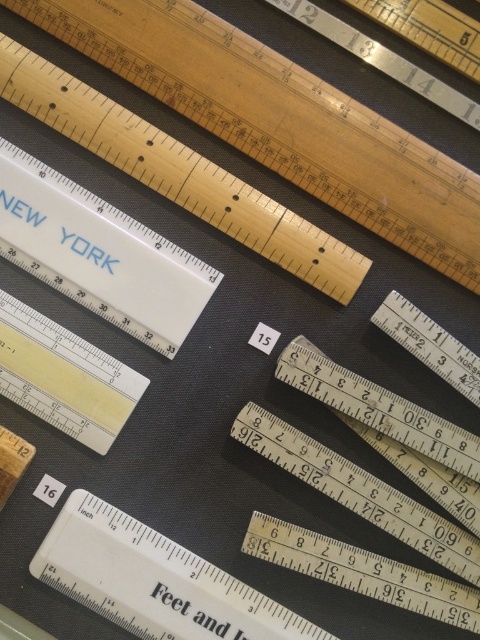
Question: Which of the following is the closest to the observer?

Choices:
 (A) (224, 637)
 (B) (176, 157)

Answer: (A)

Question: Which object appears farthest from the camera in this image?

Choices:
 (A) wooden ruler at center
 (B) wooden ruler at upper center

Answer: (B)

Question: Is wooden ruler at upper center further to the viewer compared to wooden ruler at center?

Choices:
 (A) no
 (B) yes

Answer: (B)

Question: Is white plastic ruler at lower center bigger than yellow matte ruler at center?

Choices:
 (A) no
 (B) yes

Answer: (B)

Question: Which of the following is the farthest from the observer?

Choices:
 (A) (425, 573)
 (B) (325, 285)
 (C) (282, 628)
 (D) (24, 317)

Answer: (B)

Question: Is wooden ruler at upper center smaller than white plastic ruler at lower center?

Choices:
 (A) yes
 (B) no

Answer: (B)